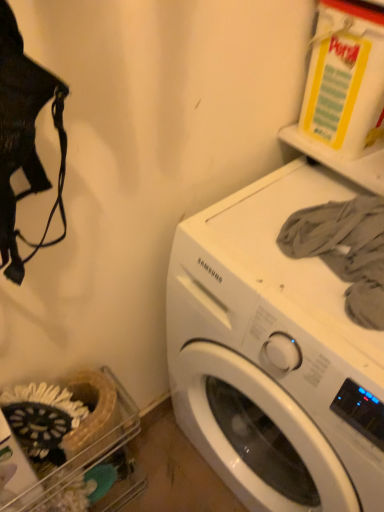
Question: Is gray cotton shirt at upper right shorter than white glossy washing machine at center?

Choices:
 (A) no
 (B) yes

Answer: (B)

Question: From the image's perspective, would you say gray cotton shirt at upper right is positioned over white glossy washing machine at center?

Choices:
 (A) yes
 (B) no

Answer: (A)

Question: Is gray cotton shirt at upper right facing away from white glossy washing machine at center?

Choices:
 (A) no
 (B) yes

Answer: (A)

Question: Considering the relative sizes of gray cotton shirt at upper right and white glossy washing machine at center in the image provided, is gray cotton shirt at upper right smaller than white glossy washing machine at center?

Choices:
 (A) no
 (B) yes

Answer: (B)

Question: Considering the relative positions of gray cotton shirt at upper right and white glossy washing machine at center in the image provided, is gray cotton shirt at upper right in front of white glossy washing machine at center?

Choices:
 (A) yes
 (B) no

Answer: (B)

Question: Is gray cotton shirt at upper right at the left side of white glossy washing machine at center?

Choices:
 (A) yes
 (B) no

Answer: (A)

Question: From the image's perspective, is white glossy washing machine at center located beneath gray cotton shirt at upper right?

Choices:
 (A) yes
 (B) no

Answer: (A)

Question: Would you say white glossy washing machine at center is outside gray cotton shirt at upper right?

Choices:
 (A) yes
 (B) no

Answer: (A)

Question: Considering the relative sizes of white glossy washing machine at center and gray cotton shirt at upper right in the image provided, is white glossy washing machine at center smaller than gray cotton shirt at upper right?

Choices:
 (A) yes
 (B) no

Answer: (B)

Question: Is white glossy washing machine at center facing away from gray cotton shirt at upper right?

Choices:
 (A) no
 (B) yes

Answer: (A)

Question: Can you confirm if white glossy washing machine at center is shorter than gray cotton shirt at upper right?

Choices:
 (A) yes
 (B) no

Answer: (B)

Question: Does white glossy washing machine at center have a greater width compared to gray cotton shirt at upper right?

Choices:
 (A) yes
 (B) no

Answer: (A)

Question: Considering the positions of gray cotton shirt at upper right and white glossy washing machine at center in the image, is gray cotton shirt at upper right taller or shorter than white glossy washing machine at center?

Choices:
 (A) tall
 (B) short

Answer: (B)